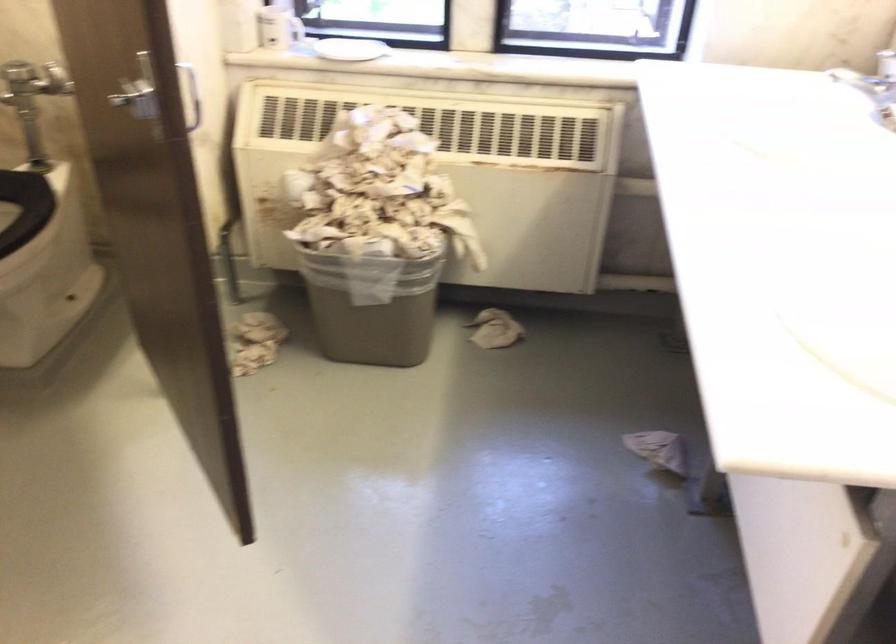
Where would you lift the white plate? Please return your answer as a coordinate pair (x, y).

(349, 49)